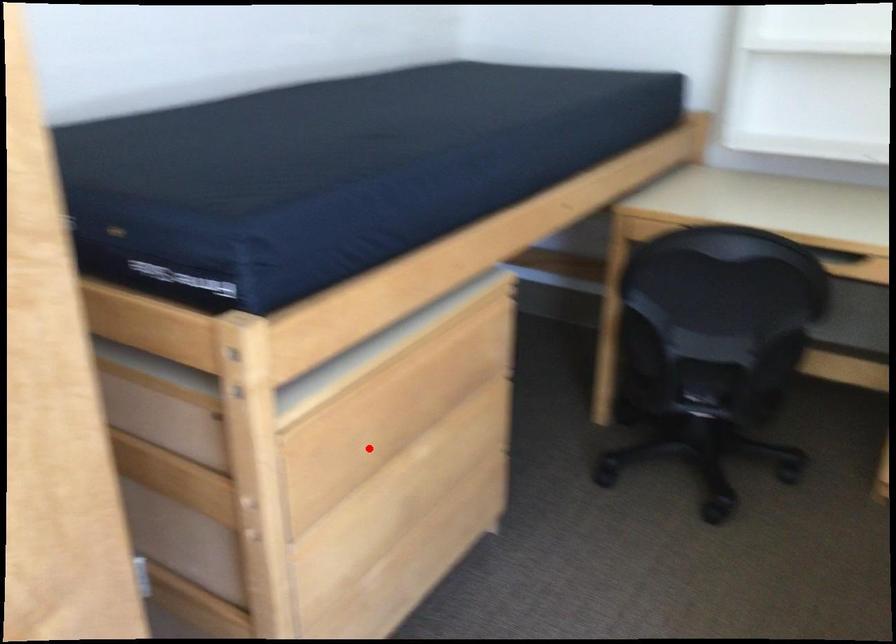
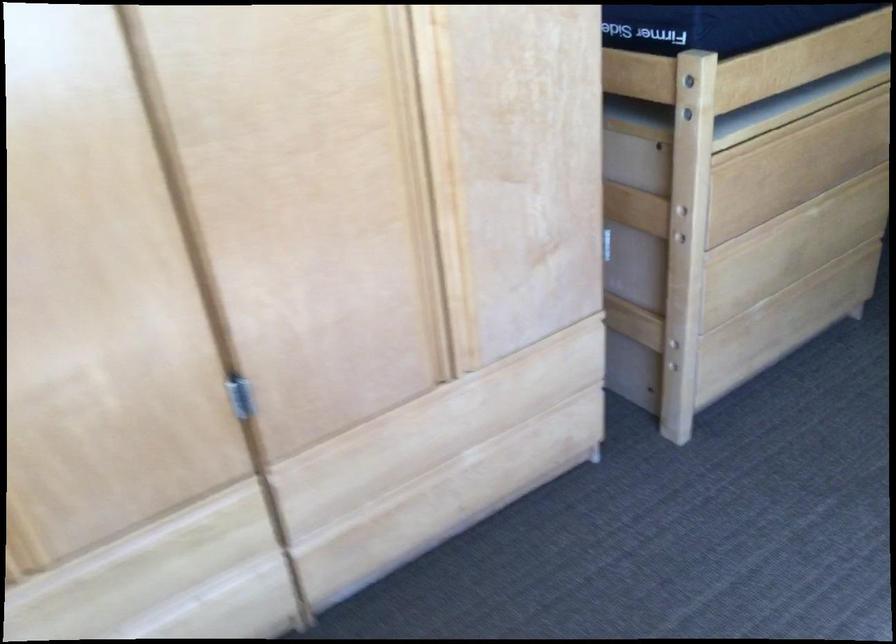
Locate, in the second image, the point that corresponds to the highlighted location in the first image.

(767, 185)